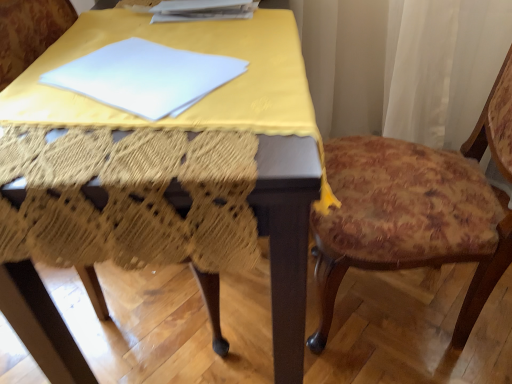
What do you see at coordinates (202, 10) in the screenshot? This screenshot has height=384, width=512. I see `white paper at upper center` at bounding box center [202, 10].

In order to face yellow fabric-covered table at center, should I rotate leftwards or rightwards?

A 7.427 degree turn to the left will do.

This screenshot has height=384, width=512. What are the coordinates of `floral fabric cushion at right` in the screenshot? It's located at (419, 210).

The width and height of the screenshot is (512, 384). Identify the location of paperback book behind the yellow fabric-covered table at center. (202, 10).

Considering the sizes of objects yellow fabric-covered table at center and white paper at upper center in the image provided, who is taller, yellow fabric-covered table at center or white paper at upper center?

With more height is yellow fabric-covered table at center.

Considering the sizes of objects yellow fabric-covered table at center and white paper at upper center in the image provided, who is thinner, yellow fabric-covered table at center or white paper at upper center?

With smaller width is white paper at upper center.

Is floral fabric cushion at right aimed at white paper at upper center?

Yes.

Is point (473, 244) in front of point (213, 4)?

That is True.

From a real-world perspective, is floral fabric cushion at right under white paper at upper center?

Yes, from a real-world perspective, floral fabric cushion at right is beneath white paper at upper center.

Which is farther from the camera, (215,95) or (381,259)?

The point (381,259) is farther.

Is yellow fabric-covered table at center oriented away from floral fabric cushion at right?

No, yellow fabric-covered table at center's orientation is not away from floral fabric cushion at right.

This screenshot has width=512, height=384. In order to click on table on the left of floral fabric cushion at right in this screenshot , I will do `click(138, 166)`.

Can you confirm if white paper at upper center is smaller than yellow fabric-covered table at center?

Yes, white paper at upper center is smaller than yellow fabric-covered table at center.

Is white paper at upper center directly adjacent to yellow fabric-covered table at center?

No, white paper at upper center is not in contact with yellow fabric-covered table at center.

From a real-world perspective, which object rests below the other?

yellow fabric-covered table at center, from a real-world perspective.

From the image's perspective, is white paper at upper center located beneath yellow fabric-covered table at center?

No, from the image's perspective, white paper at upper center is not beneath yellow fabric-covered table at center.

Can you confirm if white paper at upper center is taller than floral fabric cushion at right?

Incorrect, the height of white paper at upper center is not larger of that of floral fabric cushion at right.

Between white paper at upper center and floral fabric cushion at right, which one has larger width?

Wider between the two is floral fabric cushion at right.

Is white paper at upper center oriented away from floral fabric cushion at right?

No, floral fabric cushion at right is not at the back of white paper at upper center.

Is floral fabric cushion at right wider than yellow fabric-covered table at center?

No.

Does point (450, 173) appear closer or farther from the camera than point (36, 219)?

Point (450, 173) is farther from the camera than point (36, 219).

Is floral fabric cushion at right oriented away from yellow fabric-covered table at center?

floral fabric cushion at right is not turned away from yellow fabric-covered table at center.

At what (x,y) coordinates should I click in order to perform the action: click on table in front of the floral fabric cushion at right. Please return your answer as a coordinate pair (x, y). Looking at the image, I should click on (138, 166).

Locate an element on the screen. This screenshot has width=512, height=384. paperback book that is on the right side of yellow fabric-covered table at center is located at coordinates (202, 10).

Image resolution: width=512 pixels, height=384 pixels. In order to click on paperback book located above the floral fabric cushion at right (from a real-world perspective) in this screenshot , I will do `click(202, 10)`.

From the image, which object appears to be farther from white paper at upper center, floral fabric cushion at right or yellow fabric-covered table at center?

floral fabric cushion at right is further to white paper at upper center.

Considering their positions, is yellow fabric-covered table at center positioned closer to white paper at upper center than floral fabric cushion at right?

Based on the image, yellow fabric-covered table at center appears to be nearer to white paper at upper center.

Based on their spatial positions, is white paper at upper center or yellow fabric-covered table at center further from floral fabric cushion at right?

Among the two, white paper at upper center is located further to floral fabric cushion at right.

Estimate the real-world distances between objects in this image. Which object is further from yellow fabric-covered table at center, white paper at upper center or floral fabric cushion at right?

Based on the image, floral fabric cushion at right appears to be further to yellow fabric-covered table at center.

Based on their spatial positions, is floral fabric cushion at right or white paper at upper center further from yellow fabric-covered table at center?

floral fabric cushion at right lies further to yellow fabric-covered table at center than the other object.

Based on their spatial positions, is yellow fabric-covered table at center or white paper at upper center further from floral fabric cushion at right?

white paper at upper center lies further to floral fabric cushion at right than the other object.

Find the location of `paperback book situated between yellow fabric-covered table at center and floral fabric cushion at right from left to right`. paperback book situated between yellow fabric-covered table at center and floral fabric cushion at right from left to right is located at coordinates (202, 10).